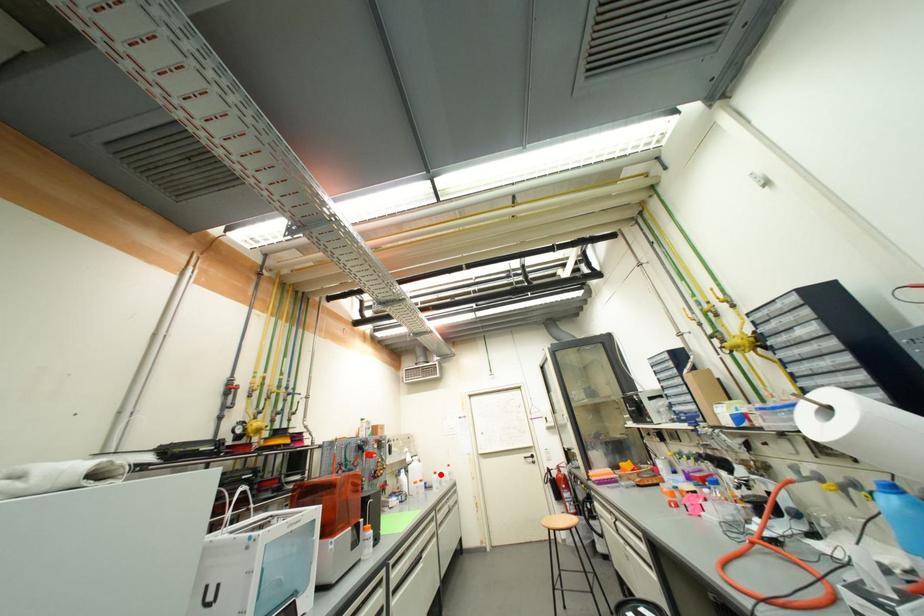
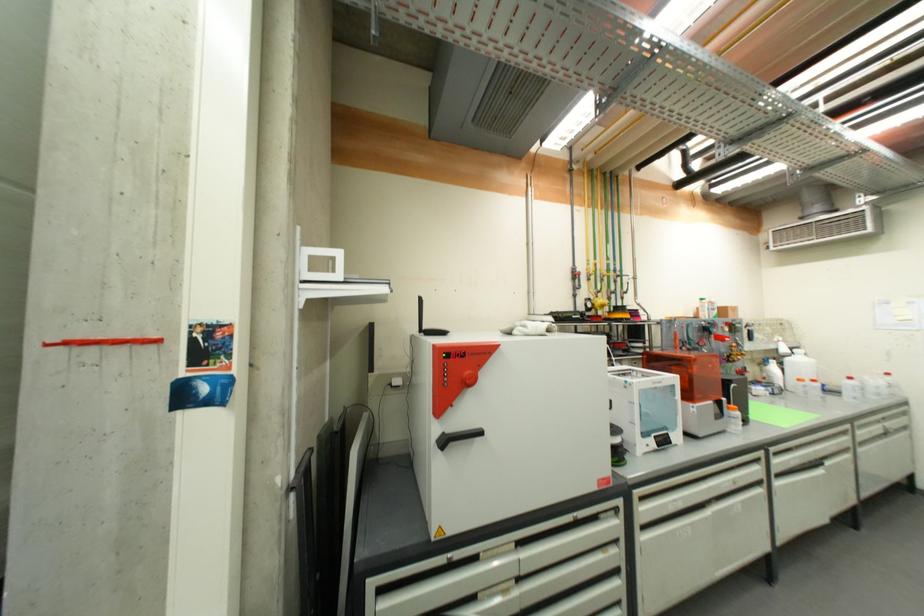
Where in the second image is the point corresponding to the highlighted location from the first image?

(856, 379)